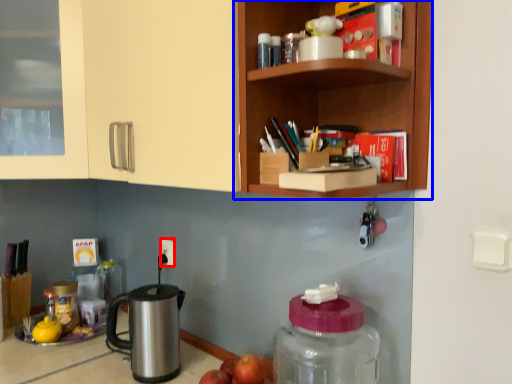
Question: Which point is closer to the camera, electric outlet (highlighted by a red box) or shelf (highlighted by a blue box)?

Choices:
 (A) electric outlet
 (B) shelf

Answer: (B)